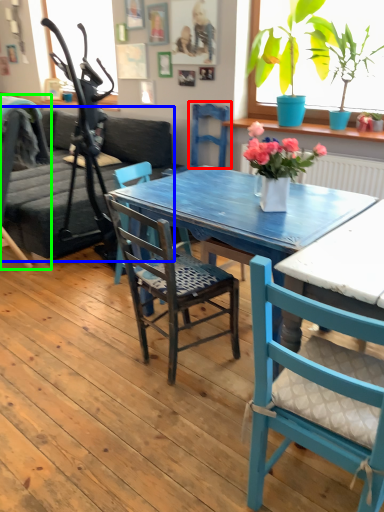
Question: Considering the real-world distances, which object is farthest from armchair (highlighted by a red box)? studio couch (highlighted by a blue box) or chair (highlighted by a green box)?

Choices:
 (A) studio couch
 (B) chair

Answer: (B)